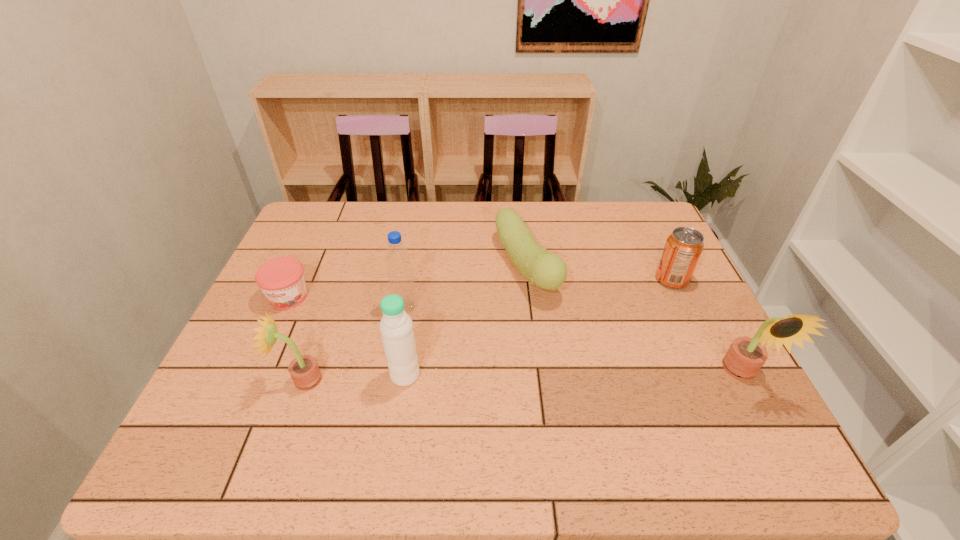
Locate an element on the screen. Image resolution: width=960 pixels, height=540 pixels. vacant space located on the face of the sixth object from right to left is located at coordinates (257, 380).

The height and width of the screenshot is (540, 960). What are the coordinates of `vacant space positioned 0.100m on the face of the sixth object from right to left` in the screenshot? It's located at (240, 380).

Locate an element on the screen. vacant region located on the face of the sixth object from right to left is located at coordinates (222, 380).

Find the location of a particular element. The image size is (960, 540). vacant space located on the front of the fifth object from left to right is located at coordinates (539, 368).

The height and width of the screenshot is (540, 960). Find the location of `vacant space located on the front of the farther water bottle`. vacant space located on the front of the farther water bottle is located at coordinates (397, 349).

Identify the location of vacant space located on the back of the soda can. This screenshot has width=960, height=540. (644, 221).

Locate an element on the screen. This screenshot has width=960, height=540. vacant space located 0.310m on the front label of the shortest object is located at coordinates (232, 421).

In order to click on vacant point located 0.230m on the right of the nearer water bottle in this screenshot , I will do `click(520, 375)`.

Where is `object situated at the far edge`? The image size is (960, 540). object situated at the far edge is located at coordinates (548, 271).

Where is `water bottle that is at the near edge`? Image resolution: width=960 pixels, height=540 pixels. water bottle that is at the near edge is located at coordinates (396, 326).